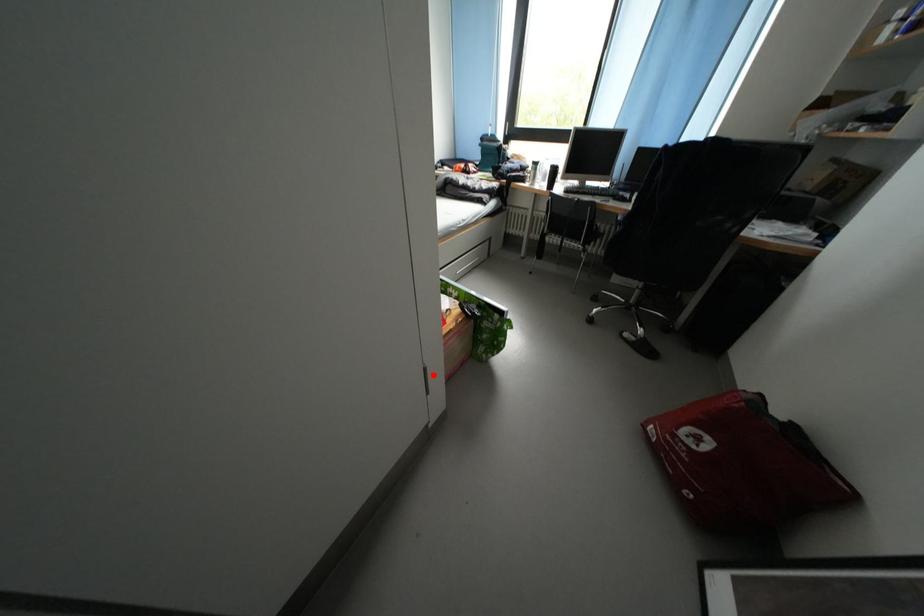
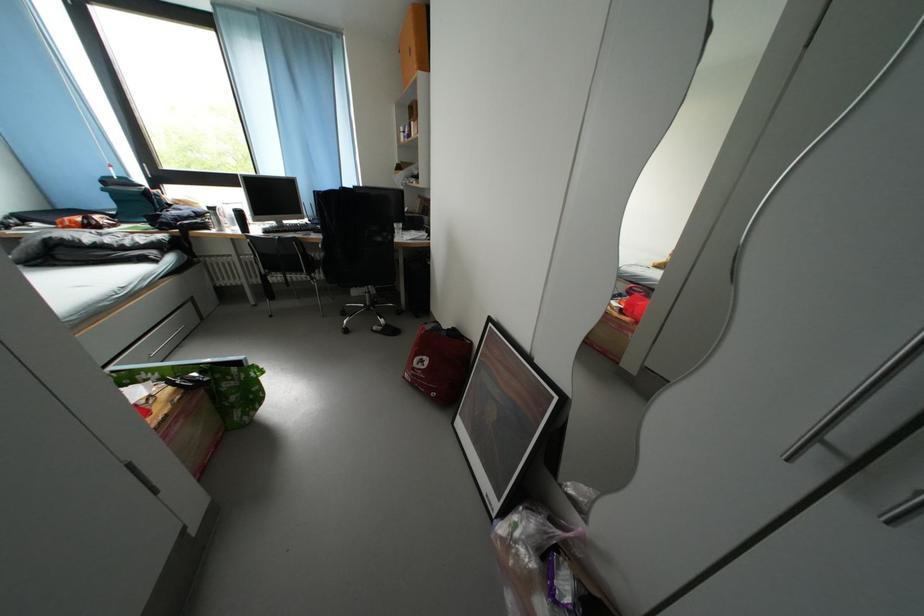
The point at the highlighted location is marked in the first image. Where is the corresponding point in the second image?

(138, 469)